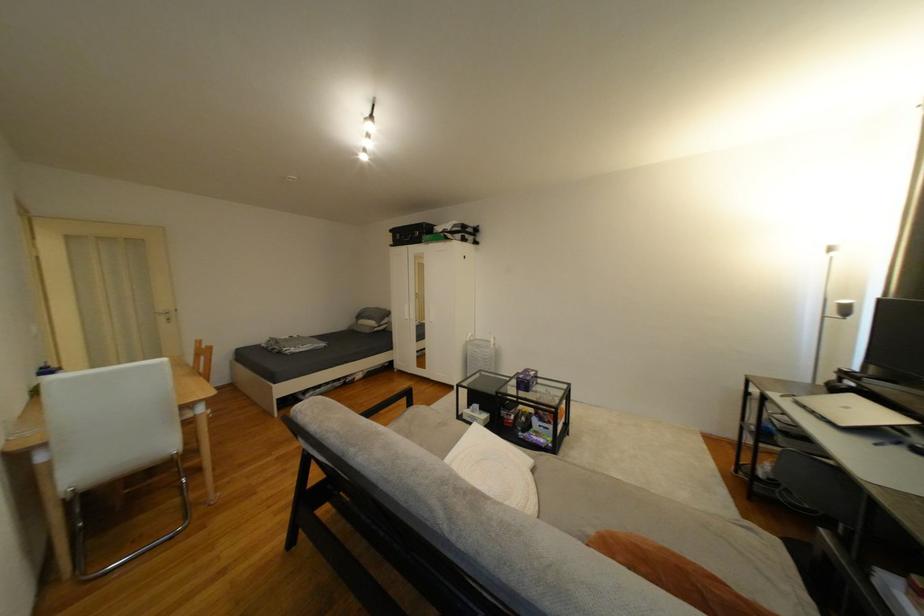
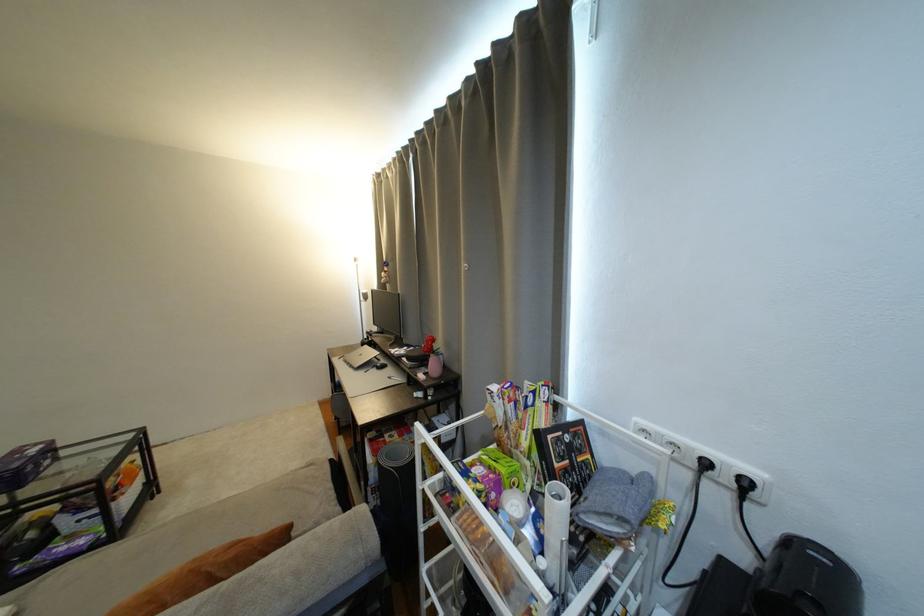
Locate, in the second image, the point that corresponds to point (708, 588) in the first image.

(216, 570)